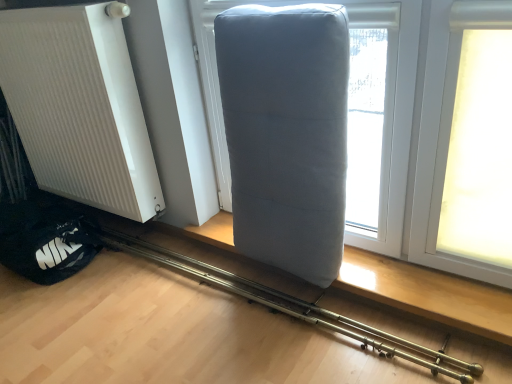
Question: In the image, is gray fabric pillow at center positioned in front of or behind white ribbed radiator at left?

Choices:
 (A) front
 (B) behind

Answer: (A)

Question: Considering the positions of gray fabric pillow at center and white ribbed radiator at left in the image, is gray fabric pillow at center taller or shorter than white ribbed radiator at left?

Choices:
 (A) tall
 (B) short

Answer: (B)

Question: Estimate the real-world distances between objects in this image. Which object is closer to the white ribbed radiator at left?

Choices:
 (A) gray fabric pillow at center
 (B) matte gray pillow at center

Answer: (B)

Question: Which object is positioned closest to the gray fabric pillow at center?

Choices:
 (A) matte gray pillow at center
 (B) white ribbed radiator at left

Answer: (A)